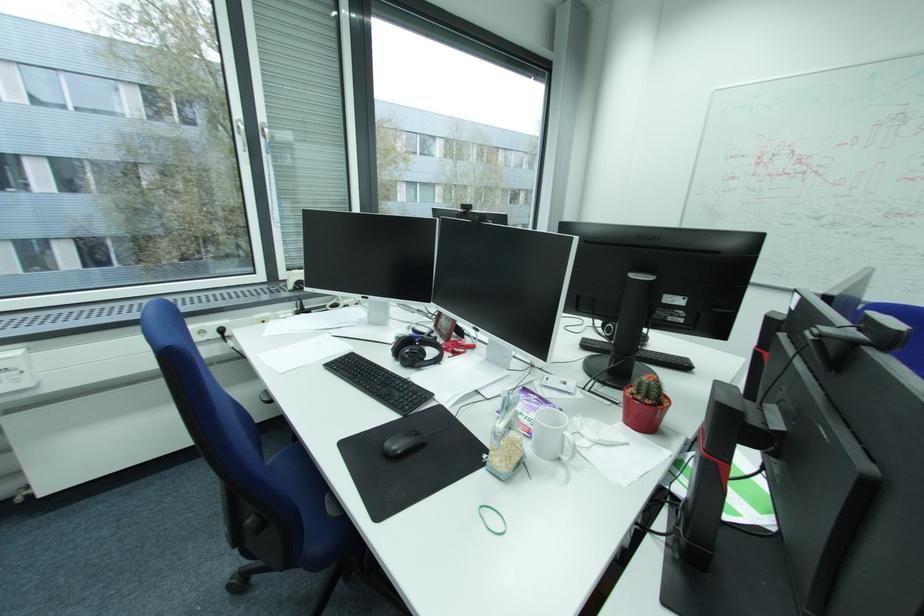
Find where to lift the plastic bag of grains. Please return your answer as a coordinate pair (x, y).

(505, 440)